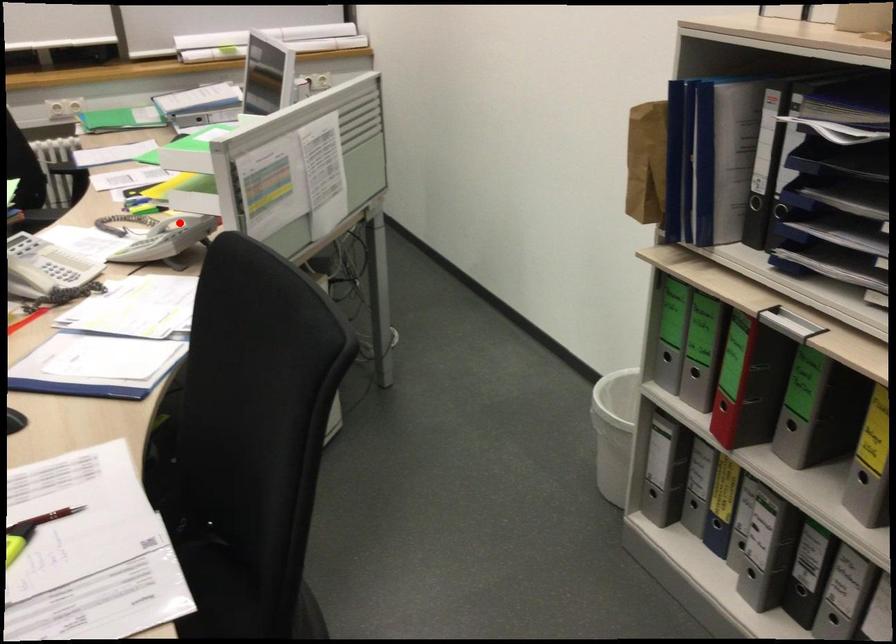
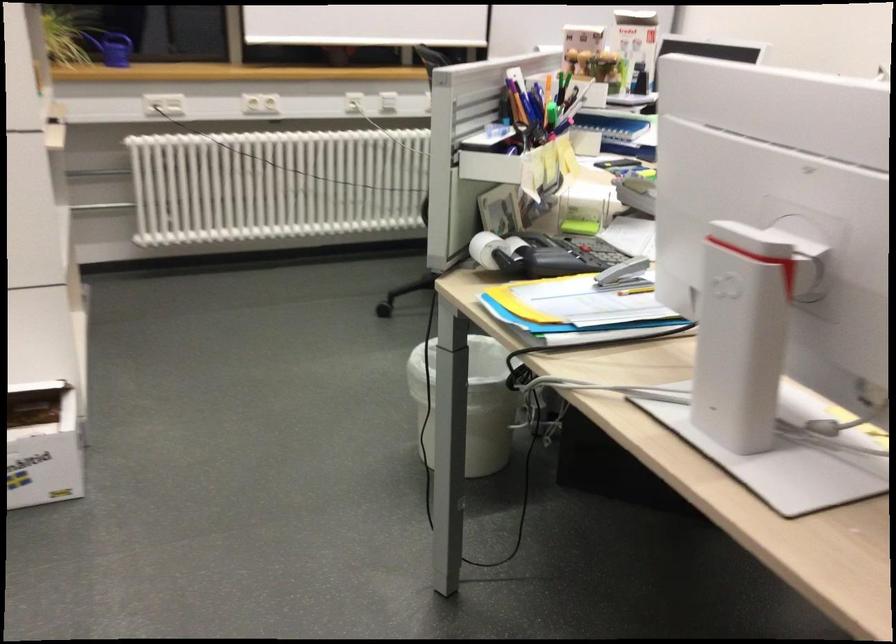
Question: I am providing you with two images of the same scene from different viewpoints. A red point is marked on the first image. Is the red point's position out of view in image 2?

Choices:
 (A) Yes
 (B) No

Answer: (A)